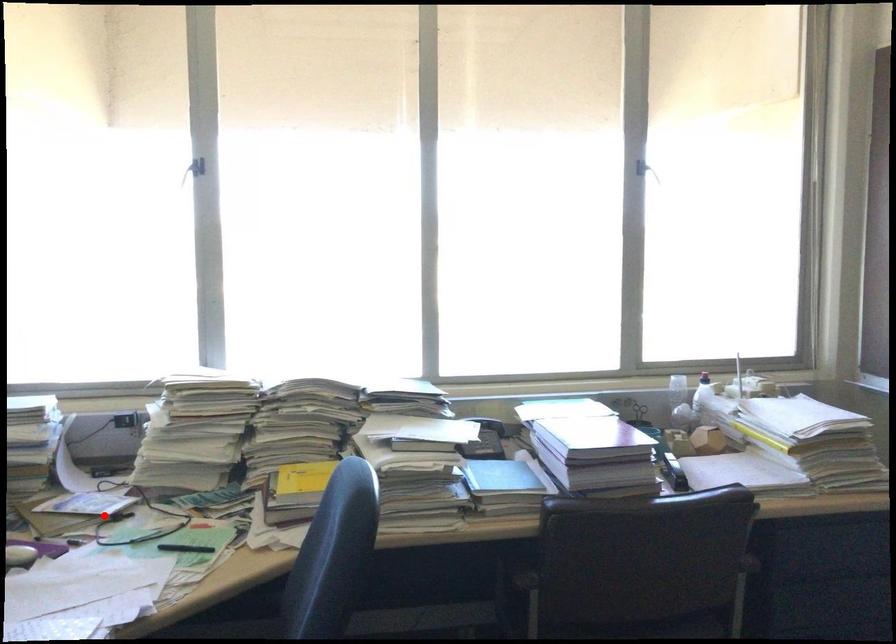
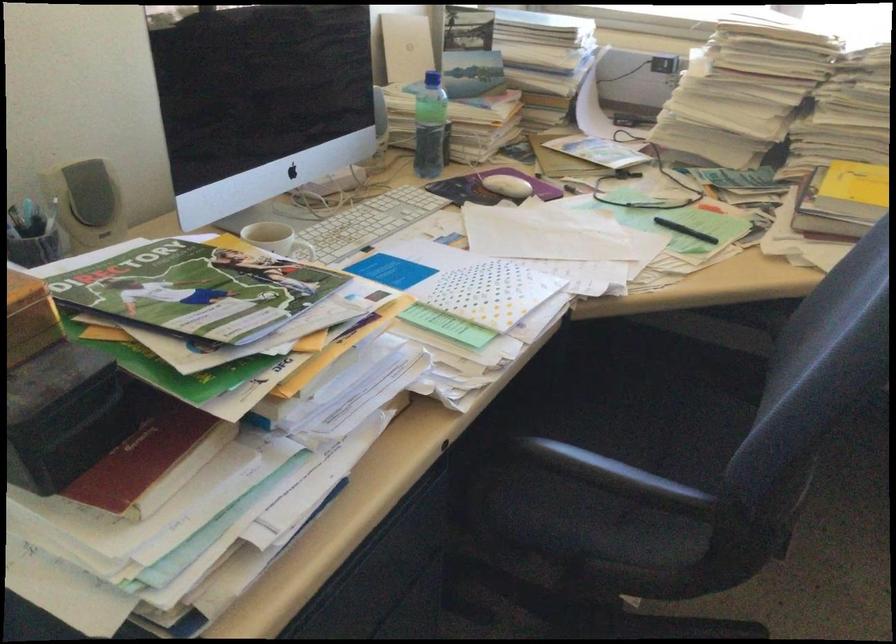
Question: I am providing you with two images of the same scene from different viewpoints. Image1 has a red point marked. In image2, the corresponding 3D location appears at what relative position? Reply with the corresponding letter.

Choices:
 (A) Closer
 (B) Farther

Answer: (A)